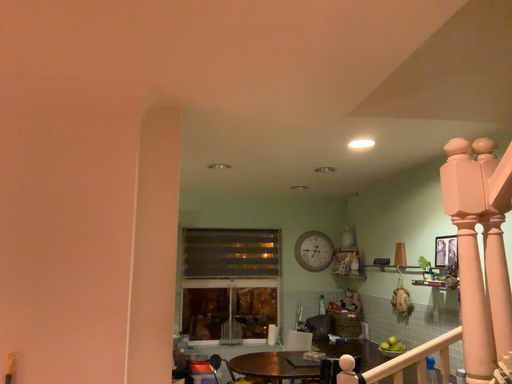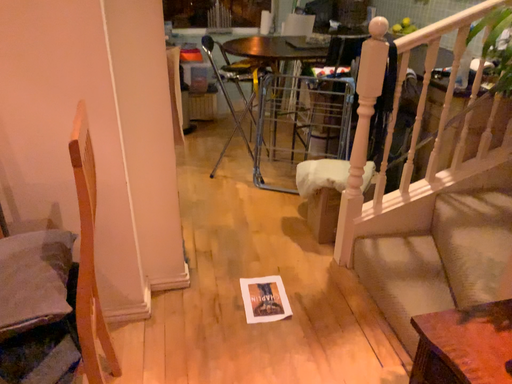
Question: Which way did the camera rotate in the video?

Choices:
 (A) rotated downward
 (B) rotated upward

Answer: (A)